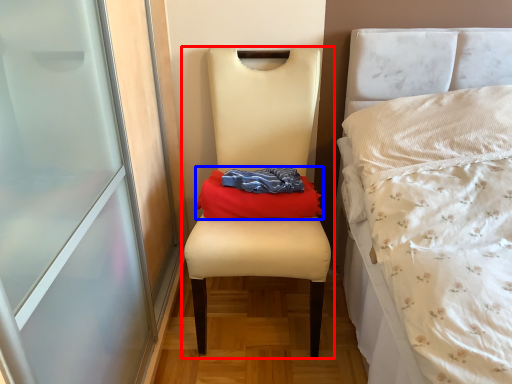
Question: Which point is closer to the camera, chair (highlighted by a red box) or material (highlighted by a blue box)?

Choices:
 (A) chair
 (B) material

Answer: (A)